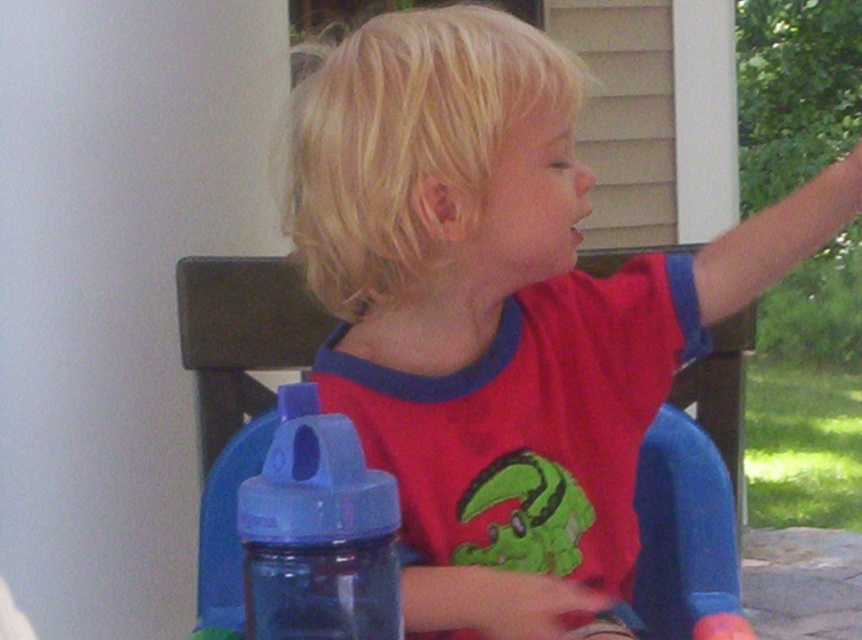
Based on the photo, you are a parent trying to ensure your child stays hydrated. You have a blue plastic bottle at lower left and a blue plastic chair at center. Which object should you place the water bottle so it is within easy reach of the child sitting on the chair?

The blue plastic bottle at lower left should be placed on the blue plastic chair at center since the chair is taller than the bottle, making it easier for the child to reach the bottle while sitting.

You are a parent looking for your child who is sitting on the blue plastic chair at center. You see the blue plastic bottle at lower left. Can you see the bottle from where the child is sitting?

The blue plastic bottle at lower left is behind the blue plastic chair at center, so the child sitting on the blue plastic chair at center cannot see the bottle because it is obstructed by the chair.